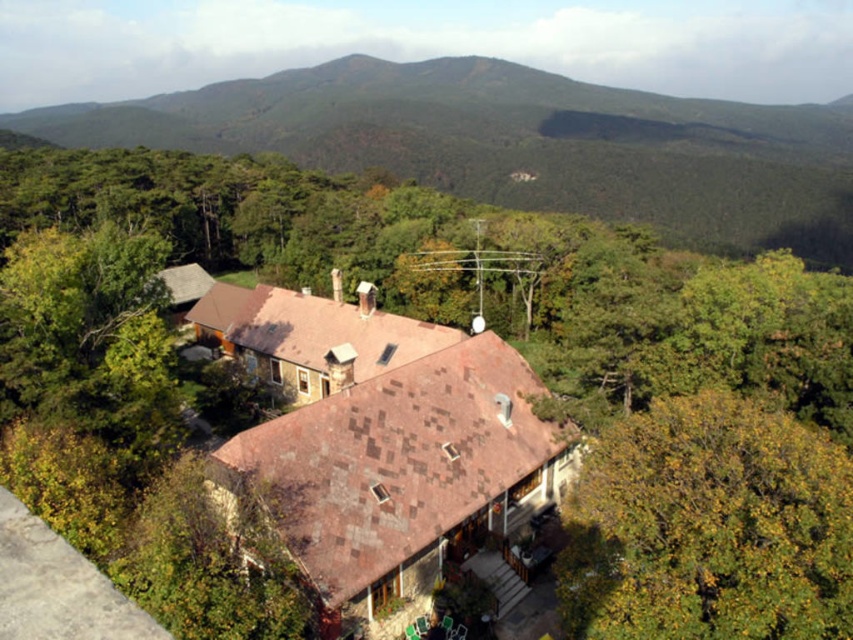
Is point (636, 211) closer to camera compared to point (816, 440)?

No, it is not.

Which is behind, point (433, 170) or point (650, 516)?

Point (433, 170)

Between point (648, 109) and point (734, 589), which one is positioned in front?

Point (734, 589)

This screenshot has width=853, height=640. In order to click on green forested mountain at upper center in this screenshot , I will do `click(519, 144)`.